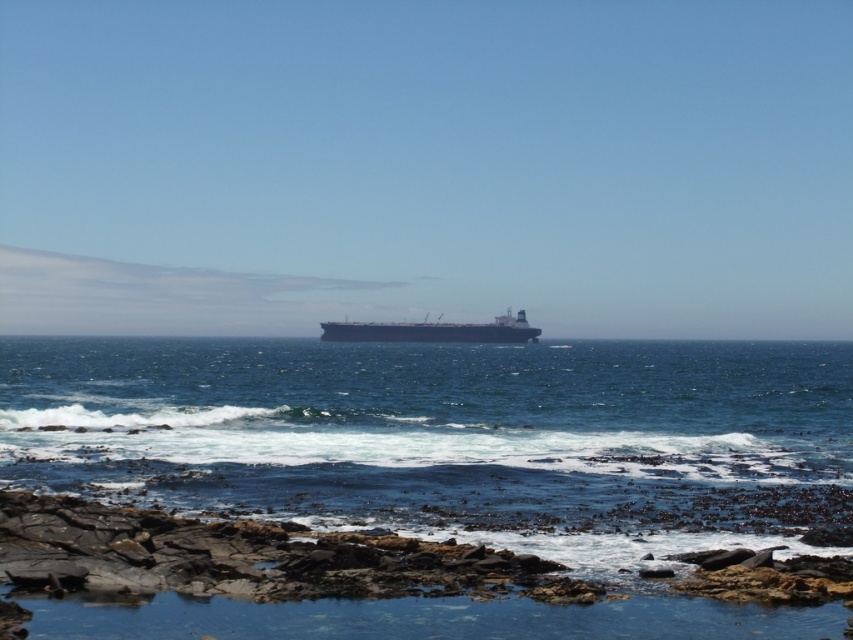
Question: Among these points, which one is farthest from the camera?

Choices:
 (A) (358, 324)
 (B) (292, 604)

Answer: (A)

Question: Observing the image, what is the correct spatial positioning of blue water at center in reference to metallic gray ship at center?

Choices:
 (A) right
 (B) left

Answer: (A)

Question: Which object appears farthest from the camera in this image?

Choices:
 (A) metallic gray ship at center
 (B) blue water at center

Answer: (A)

Question: Is blue water at center to the left of metallic gray ship at center from the viewer's perspective?

Choices:
 (A) yes
 (B) no

Answer: (B)

Question: Does blue water at center have a greater width compared to metallic gray ship at center?

Choices:
 (A) no
 (B) yes

Answer: (B)

Question: Which object is closer to the camera taking this photo?

Choices:
 (A) blue water at center
 (B) metallic gray ship at center

Answer: (A)